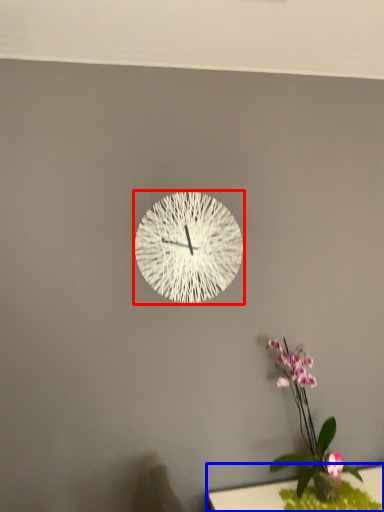
Question: Which of the following is the closest to the observer, wall clock (highlighted by a red box) or table (highlighted by a blue box)?

Choices:
 (A) wall clock
 (B) table

Answer: (B)